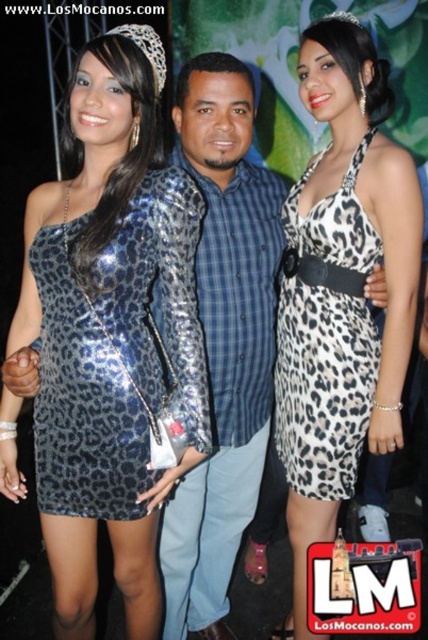
You are a photographer at the event and need to adjust the lighting to ensure both the shiny metallic dress at center and the leopard print fabric dress at center are well lit. Given their sizes, which dress might require more focused lighting to highlight its details?

The shiny metallic dress at center is larger in size than the leopard print fabric dress at center, so it might require more focused lighting to highlight its details due to its larger surface area.

You are at the center of the image and want to move towards the shiny metallic jacket at center. Which direction should you move to reach it?

Since the shiny metallic jacket at center is located at point (223,340), you should move slightly to the right and down from the exact center to reach it.